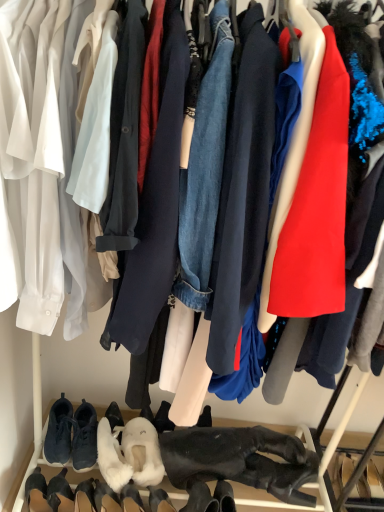
Question: Is white fluffy slippers at lower center, the second footwear viewed from the right, bigger or smaller than white suede boot at lower left, the 6th footwear from the right?

Choices:
 (A) small
 (B) big

Answer: (B)

Question: Choose the correct answer: Is white fluffy slippers at lower center, which is the 7th footwear from left to right, inside white suede boot at lower left, the 6th footwear from the right, or outside it?

Choices:
 (A) outside
 (B) inside

Answer: (A)

Question: Based on their relative distances, which object is nearer to the white fluffy boot at lower center, arranged as the 3th footwear when viewed from the right?

Choices:
 (A) white fluffy slippers at lower center, the fifth footwear when ordered from left to right
 (B) black leather boots at lower center, the 1th footwear from the right
 (C) white fluffy slippers at lower center, the second footwear viewed from the right
 (D) dark blue suede sneakers at lower left, which is counted as the second footwear, starting from the left
 (E) dark gray suede sneakers at lower left, positioned as the 4th footwear in left-to-right order

Answer: (A)

Question: Which of these objects is positioned closest to the white fluffy boot at lower center, the sixth footwear from the left?

Choices:
 (A) black suede boot at lower left, the first footwear when ordered from left to right
 (B) dark gray suede sneakers at lower left, the fifth footwear positioned from the right
 (C) white fluffy slippers at lower center, which is the 7th footwear from left to right
 (D) dark blue suede sneakers at lower left, which appears as the seventh footwear when viewed from the right
 (E) white suede boot at lower left, the third footwear from the left

Answer: (E)